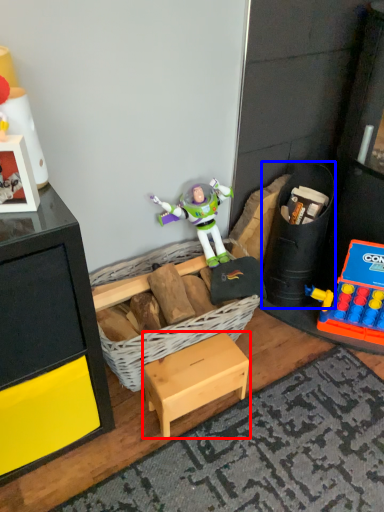
Question: Which of the following is the farthest to the observer, furniture (highlighted by a red box) or toy (highlighted by a blue box)?

Choices:
 (A) furniture
 (B) toy

Answer: (B)